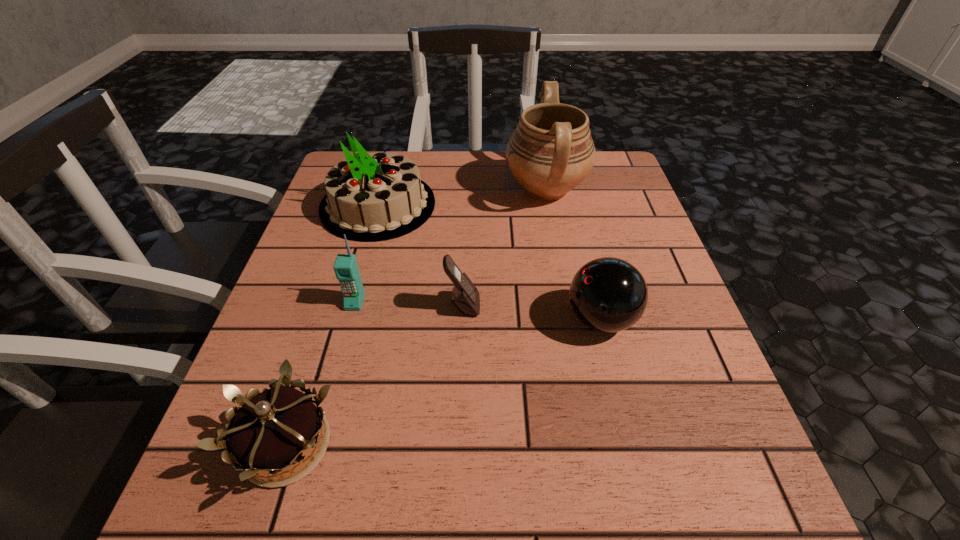
Find the location of a particular element. The height and width of the screenshot is (540, 960). birthday cake that is at the left edge is located at coordinates (370, 197).

This screenshot has width=960, height=540. What are the coordinates of `cellular telephone that is positioned at the left edge` in the screenshot? It's located at (345, 267).

Image resolution: width=960 pixels, height=540 pixels. Identify the location of crown that is at the left edge. (274, 429).

The image size is (960, 540). In order to click on urn located in the right edge section of the desktop in this screenshot , I will do `click(551, 151)`.

Where is `bowling ball positioned at the right edge`? The height and width of the screenshot is (540, 960). bowling ball positioned at the right edge is located at coordinates (608, 294).

The height and width of the screenshot is (540, 960). I want to click on object that is positioned at the far left corner, so click(370, 197).

Image resolution: width=960 pixels, height=540 pixels. Find the location of `object at the near left corner`. object at the near left corner is located at coordinates (274, 429).

Identify the location of object present at the far right corner. Image resolution: width=960 pixels, height=540 pixels. (551, 151).

At what (x,y) coordinates should I click in order to perform the action: click on free location at the far edge of the desktop. Please return your answer as a coordinate pair (x, y). This screenshot has width=960, height=540. Looking at the image, I should click on (508, 201).

I want to click on vacant space at the near edge of the desktop, so click(x=402, y=519).